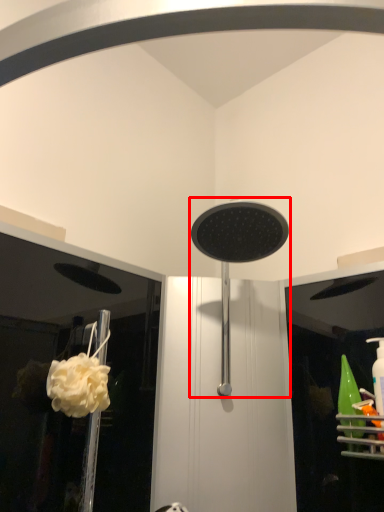
Question: From the image's perspective, where is shower (annotated by the red box) located in relation to flower in the image?

Choices:
 (A) above
 (B) below

Answer: (A)